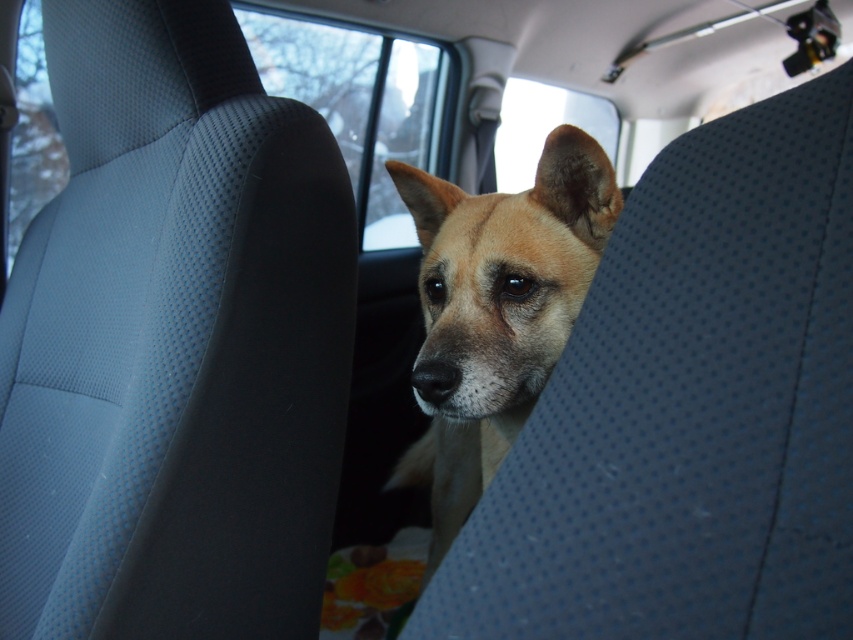
You are a passenger in the car and want to take a photo of the dog using your phone. The dog is at point (450,342). If your phone camera is 35.06 inches away from this point, is the distance sufficient to capture the dog clearly in the photo?

The point (450,342) is 35.06 inches away from the camera. This distance is likely sufficient to capture the dog clearly, as most phone cameras can focus at this range.

You are a passenger in the backseat of the car and want to look out the transparent glass window at upper center. Can the light brown fur dog at center block your view of the window?

The light brown fur dog at center has a lesser height compared to transparent glass window at upper center, so the dog is shorter than the window. Therefore, the dog might not completely block your view of the window since it is shorter than the window.